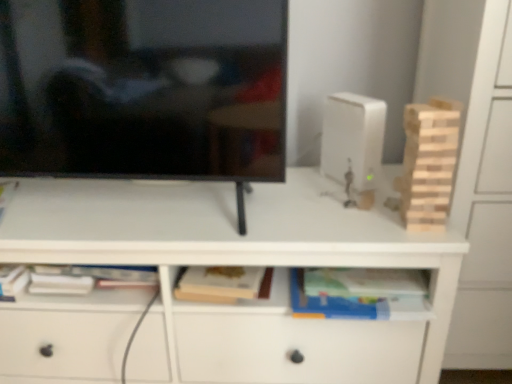
Question: Is light wood block tower at right placed right next to black glossy television at upper left?

Choices:
 (A) yes
 (B) no

Answer: (B)

Question: Is light wood block tower at right shorter than black glossy television at upper left?

Choices:
 (A) yes
 (B) no

Answer: (A)

Question: From a real-world perspective, is light wood block tower at right on top of black glossy television at upper left?

Choices:
 (A) yes
 (B) no

Answer: (B)

Question: From the image's perspective, is light wood block tower at right under black glossy television at upper left?

Choices:
 (A) no
 (B) yes

Answer: (B)

Question: From the image's perspective, would you say light wood block tower at right is positioned over black glossy television at upper left?

Choices:
 (A) no
 (B) yes

Answer: (A)

Question: From a real-world perspective, is black glossy television at upper left positioned above or below light wood block tower at right?

Choices:
 (A) below
 (B) above

Answer: (B)

Question: Based on their positions, is black glossy television at upper left located to the left or right of light wood block tower at right?

Choices:
 (A) left
 (B) right

Answer: (A)

Question: Considering the positions of black glossy television at upper left and light wood block tower at right in the image, is black glossy television at upper left wider or thinner than light wood block tower at right?

Choices:
 (A) wide
 (B) thin

Answer: (A)

Question: Is black glossy television at upper left inside or outside of light wood block tower at right?

Choices:
 (A) inside
 (B) outside

Answer: (B)

Question: In the image, is light wood block tower at right positioned in front of or behind wooden tower at right?

Choices:
 (A) front
 (B) behind

Answer: (B)

Question: Considering the positions of light wood block tower at right and wooden tower at right in the image, is light wood block tower at right taller or shorter than wooden tower at right?

Choices:
 (A) short
 (B) tall

Answer: (A)

Question: From the image's perspective, relative to wooden tower at right, is light wood block tower at right above or below?

Choices:
 (A) above
 (B) below

Answer: (A)

Question: Looking at the image, does light wood block tower at right seem bigger or smaller compared to wooden tower at right?

Choices:
 (A) big
 (B) small

Answer: (B)

Question: Visually, is hardcover book at center positioned to the left or to the right of black glossy television at upper left?

Choices:
 (A) left
 (B) right

Answer: (B)

Question: Is hardcover book at center situated inside black glossy television at upper left or outside?

Choices:
 (A) inside
 (B) outside

Answer: (B)